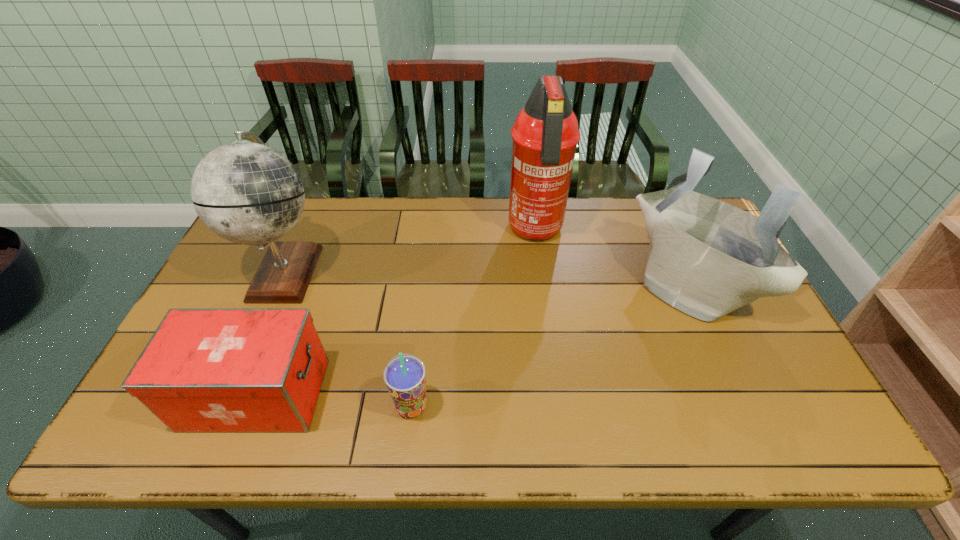
You are a GUI agent. You are given a task and a screenshot of the screen. Output one action in this format:
    pyautogui.click(x=<x>, y=<y>)
    Task: Click on the fire extinguisher at the far edge
    
    Given the screenshot: What is the action you would take?
    pyautogui.click(x=545, y=135)

This screenshot has height=540, width=960. I want to click on globe at the far edge, so click(x=246, y=192).

Image resolution: width=960 pixels, height=540 pixels. What are the coordinates of `smoothie present at the near edge` in the screenshot? It's located at (404, 375).

Identify the location of the first-aid kit at the near edge. (204, 369).

You are a GUI agent. You are given a task and a screenshot of the screen. Output one action in this format:
    pyautogui.click(x=<x>, y=<y>)
    Task: Click on the globe that is at the left edge
    This screenshot has width=960, height=540.
    Given the screenshot: What is the action you would take?
    pyautogui.click(x=246, y=192)

Image resolution: width=960 pixels, height=540 pixels. Identify the location of the first-aid kit at the left edge. 204,369.

In order to click on object present at the right edge in this screenshot , I will do `click(707, 258)`.

You are a GUI agent. You are given a task and a screenshot of the screen. Output one action in this format:
    pyautogui.click(x=<x>, y=<y>)
    Task: Click on the object that is positioned at the far left corner
    This screenshot has height=540, width=960.
    Given the screenshot: What is the action you would take?
    pyautogui.click(x=246, y=192)

The height and width of the screenshot is (540, 960). I want to click on object that is at the near left corner, so click(204, 369).

In the image, there is a desktop. Where is `vacant space at the far edge`? This screenshot has width=960, height=540. vacant space at the far edge is located at coordinates (348, 224).